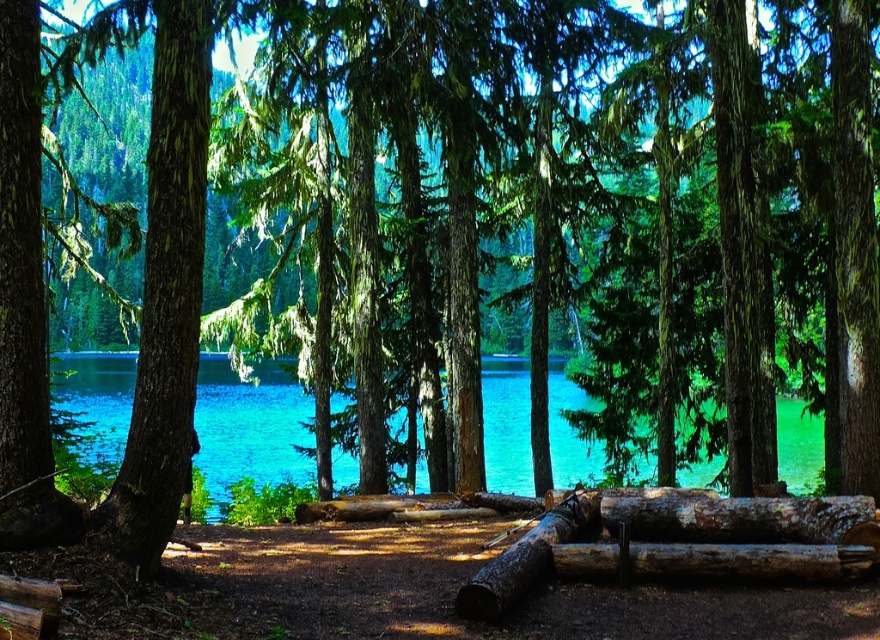
Question: Can you confirm if turquoise water at center is positioned below rusty wood log at center?

Choices:
 (A) yes
 (B) no

Answer: (A)

Question: Can you confirm if rusty wood log at center is positioned to the left of brown rough log at center?

Choices:
 (A) yes
 (B) no

Answer: (A)

Question: Which point appears closest to the camera in this image?

Choices:
 (A) (686, 531)
 (B) (710, 520)

Answer: (B)

Question: Which point is farther from the camera taking this photo?

Choices:
 (A) (114, 369)
 (B) (818, 500)

Answer: (A)

Question: Among these points, which one is nearest to the camera?

Choices:
 (A) (708, 554)
 (B) (809, 572)
 (C) (798, 504)
 (D) (488, 476)

Answer: (B)

Question: From the image, what is the correct spatial relationship of weathered brown log at center in relation to brown rough log at center?

Choices:
 (A) left
 (B) right

Answer: (B)